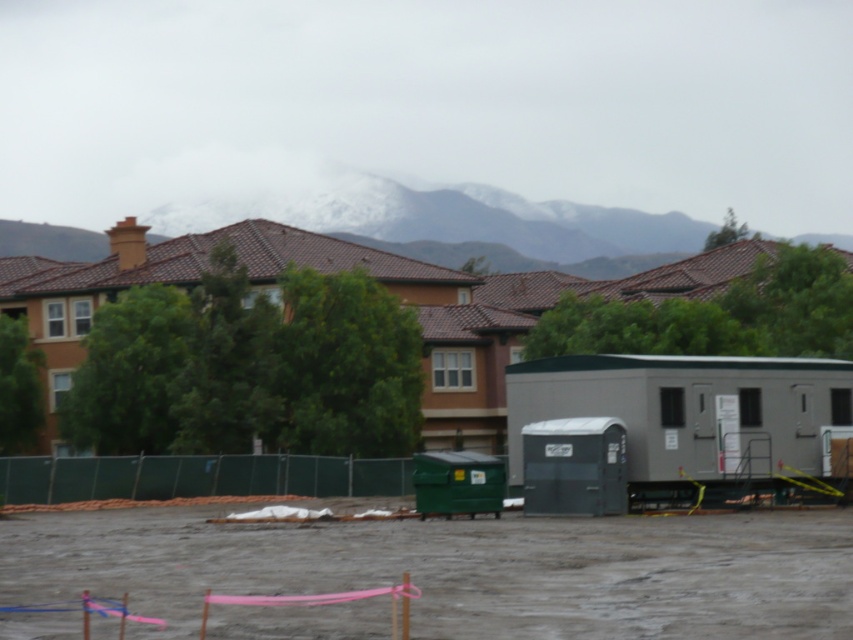
Question: Which of the following is the closest to the observer?

Choices:
 (A) (80, 476)
 (B) (368, 236)

Answer: (A)

Question: Can you confirm if snowy mountain at upper center is smaller than green mesh fence at lower center?

Choices:
 (A) yes
 (B) no

Answer: (B)

Question: Among these points, which one is farthest from the camera?

Choices:
 (A) (590, 205)
 (B) (387, 472)

Answer: (A)

Question: Is snowy mountain at upper center further to the viewer compared to green mesh fence at lower center?

Choices:
 (A) no
 (B) yes

Answer: (B)

Question: Can you confirm if snowy mountain at upper center is positioned below green mesh fence at lower center?

Choices:
 (A) no
 (B) yes

Answer: (A)